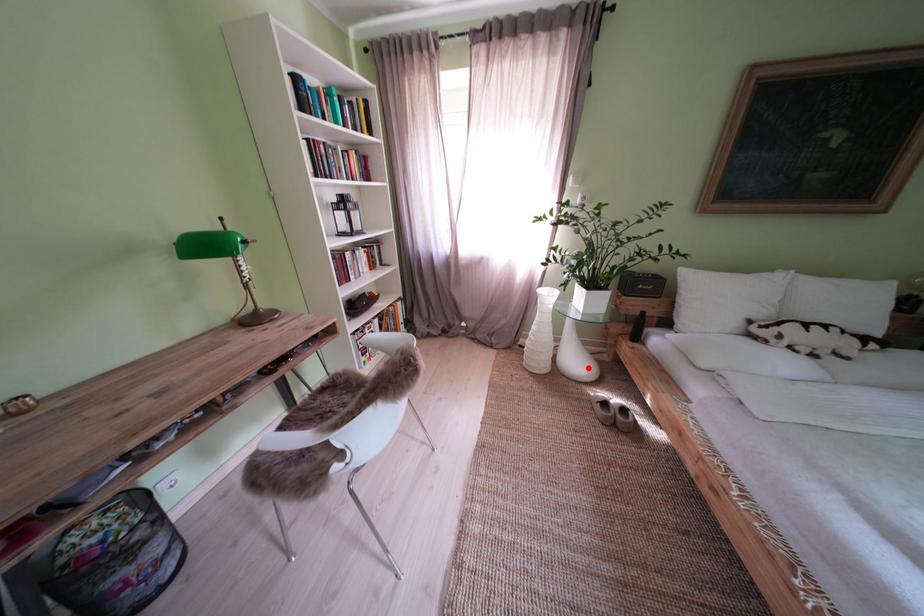
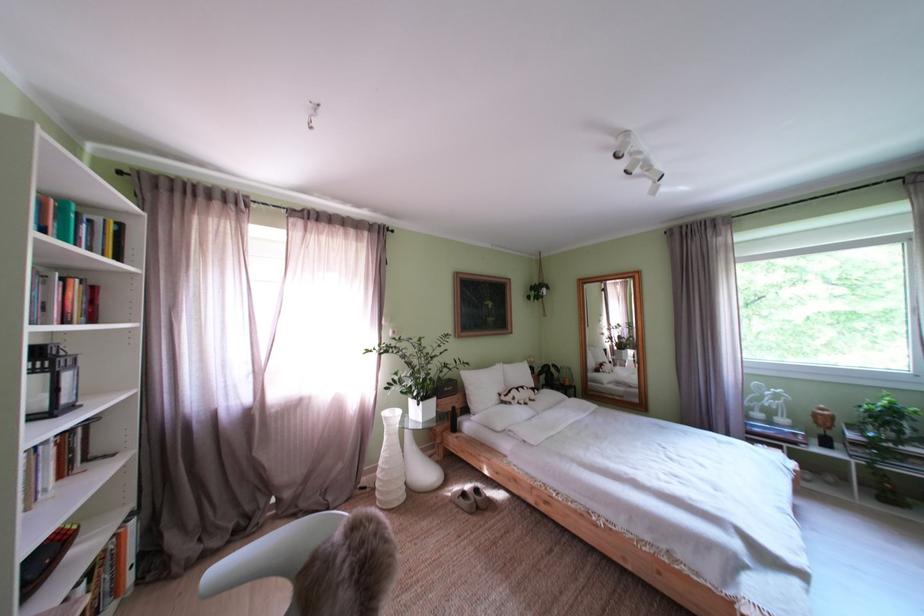
Question: I am providing you with two images of the same scene from different viewpoints. In image1, a red point is highlighted. Considering the same 3D point in image2, which of the following is correct?

Choices:
 (A) It is closer
 (B) It is farther

Answer: (B)